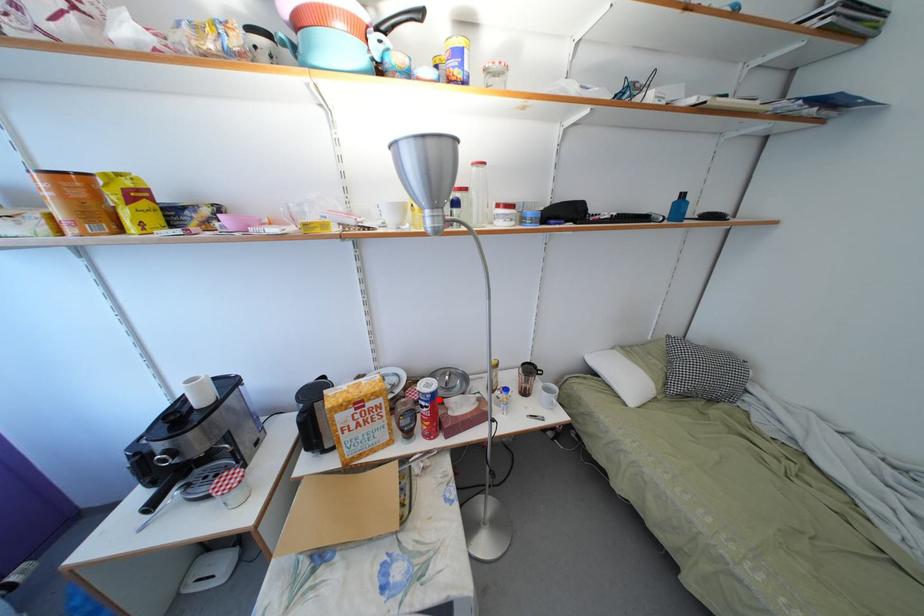
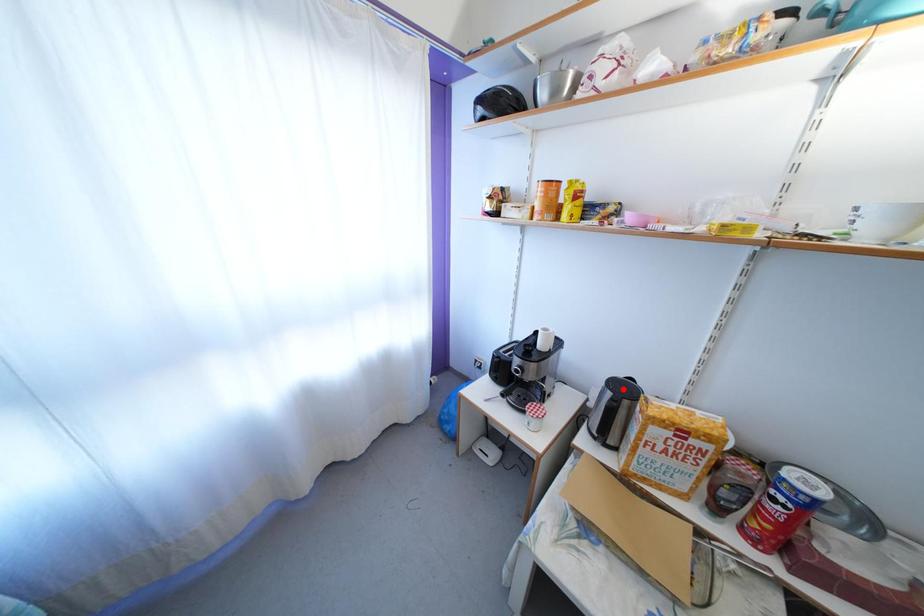
I am providing you with two images of the same scene from different viewpoints. A red point is marked on the first image and another point is marked on the second image. Is the marked point in image1 the same physical position as the marked point in image2?

No